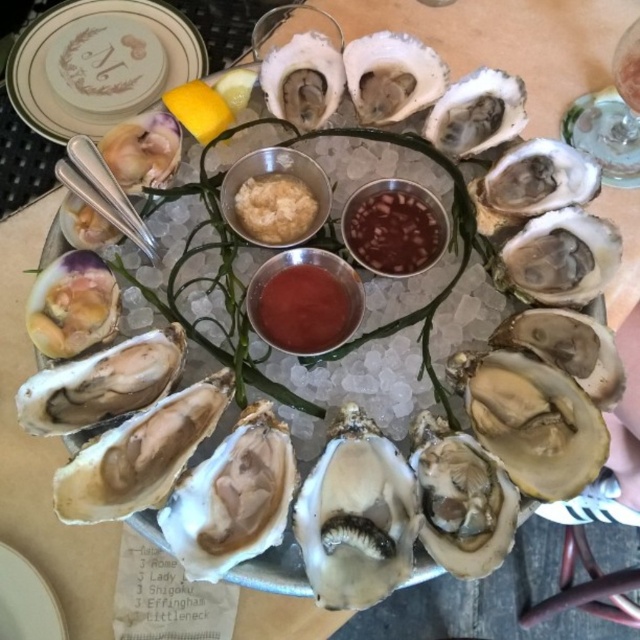
Is white creamy sauce at center bigger than white ceramic plate at lower left?

Yes, white creamy sauce at center is bigger than white ceramic plate at lower left.

Does point (291, 212) come farther from viewer compared to point (0, 566)?

No, (291, 212) is in front of (0, 566).

At what (x,y) coordinates should I click in order to perform the action: click on white creamy sauce at center. Please return your answer as a coordinate pair (x, y). The width and height of the screenshot is (640, 640). Looking at the image, I should click on (275, 209).

Between smokey brown paste at center and yellow matte lemon at upper center, which one appears on the right side from the viewer's perspective?

From the viewer's perspective, smokey brown paste at center appears more on the right side.

Does point (404, 216) come in front of point (195, 118)?

Yes.

Where is `smokey brown paste at center`? The height and width of the screenshot is (640, 640). smokey brown paste at center is located at coordinates (394, 234).

Identify the location of matte white plate at upper left. (99, 65).

Is point (13, 83) positioned behind point (371, 262)?

Yes.

The width and height of the screenshot is (640, 640). I want to click on matte white plate at upper left, so click(x=99, y=65).